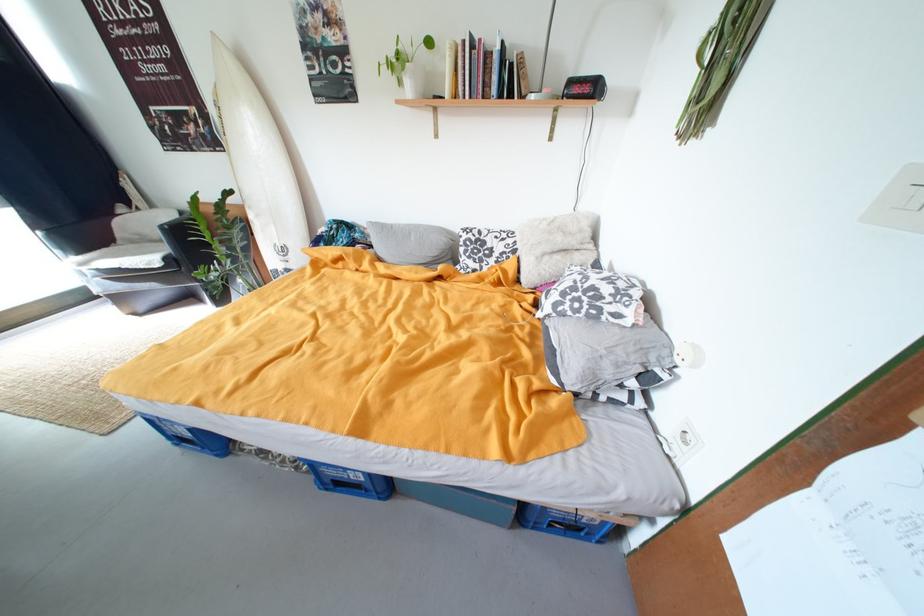
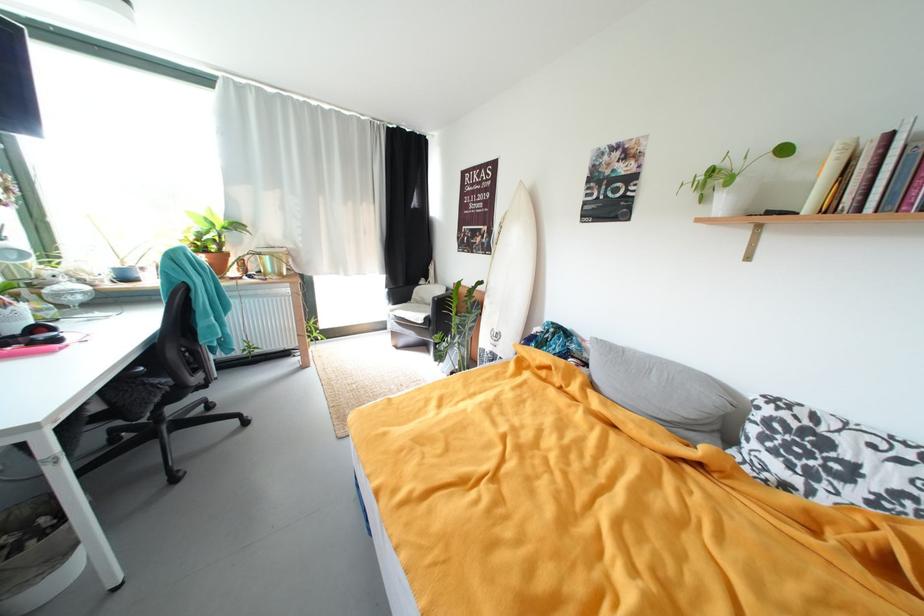
Locate, in the second image, the point that corresponds to (500,262) in the first image.

(861, 493)